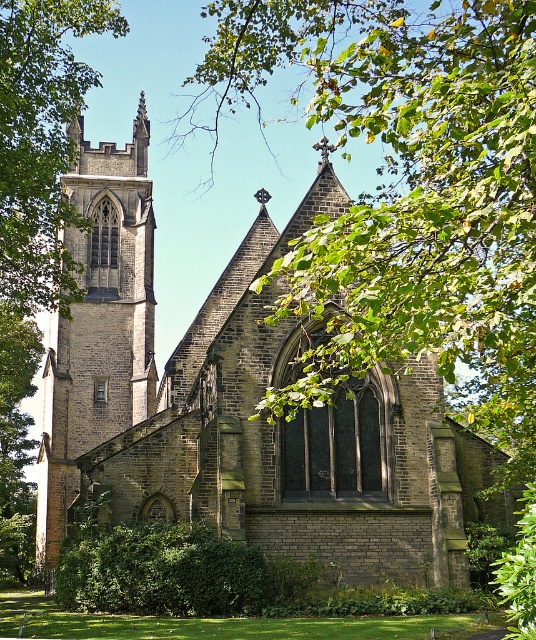
You are standing at the coordinates 0.5, 0.5 in the image. Which direction should you move to reach the brown stone church at center?

The brown stone church at center is located at point (241, 406). Since you are at (268, 320), you should move to the right and slightly downward to reach it.